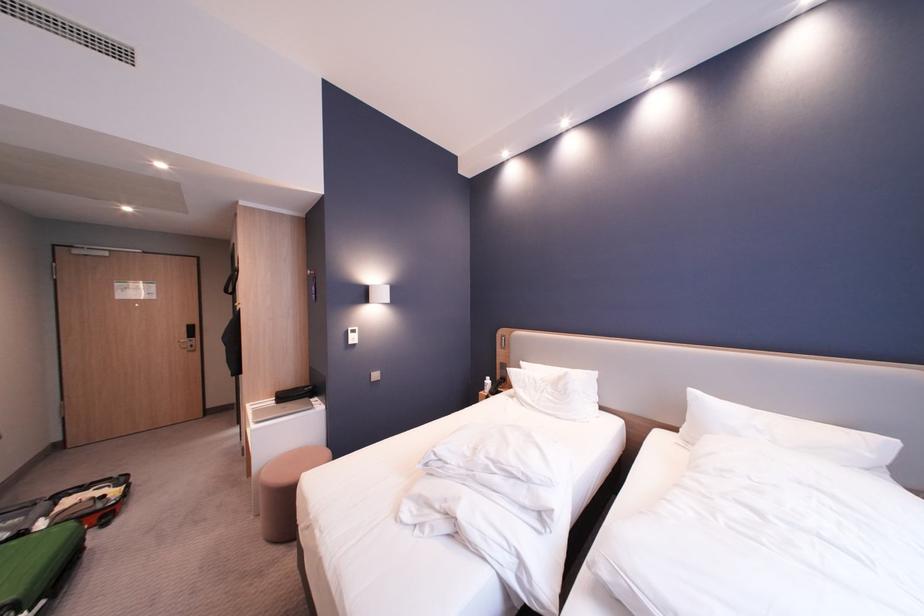
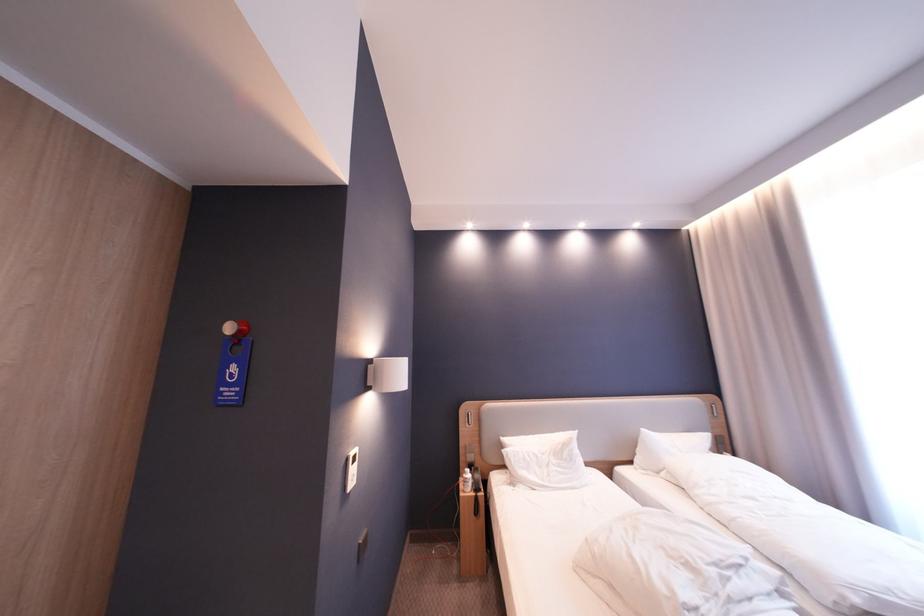
In the second image, find the point that corresponds to the point at 687,430 in the first image.

(641, 464)